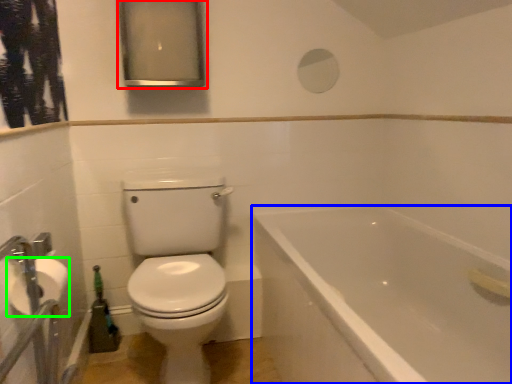
Question: Which object is the closest to the medicine cabinet (highlighted by a red box)? Choose among these: bathtub (highlighted by a blue box) or toilet paper (highlighted by a green box).

Choices:
 (A) bathtub
 (B) toilet paper

Answer: (A)